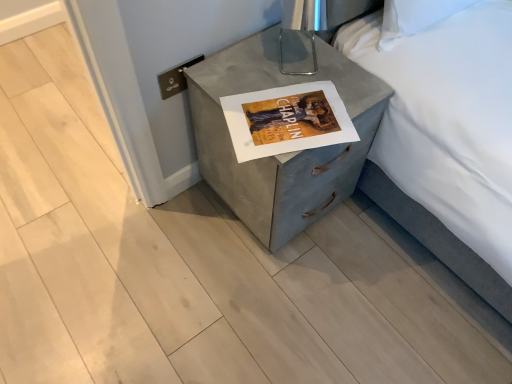
In order to click on free location above concrete side table at center (from a real-world perspective) in this screenshot , I will do coord(287,81).